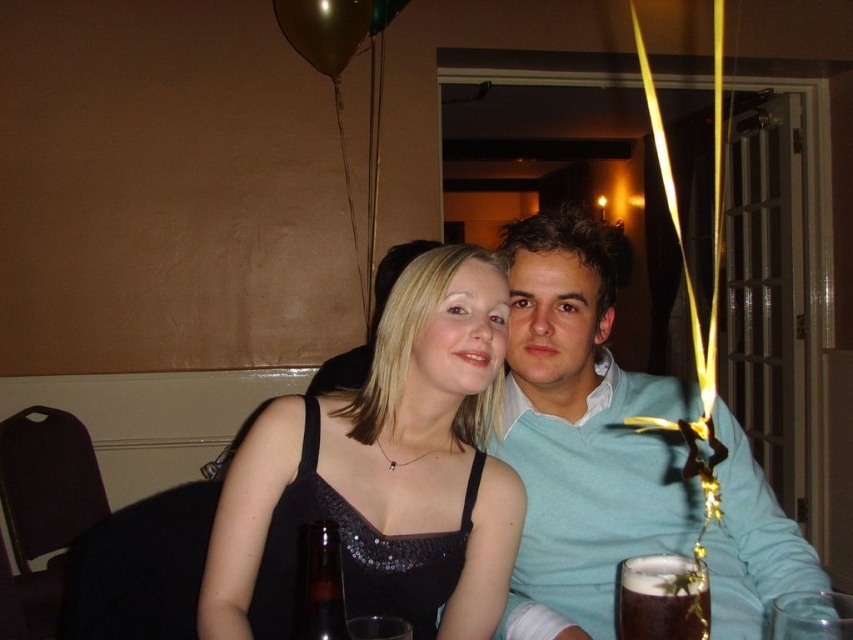
Between brown frothy beer at lower right and brown glass bottle at lower center, which one has less height?

brown frothy beer at lower right is shorter.

Who is taller, brown frothy beer at lower right or brown glass bottle at lower center?

Standing taller between the two is brown glass bottle at lower center.

Between point (660, 572) and point (312, 557), which one is positioned in front?

Point (312, 557) is in front.

At what (x,y) coordinates should I click in order to perform the action: click on brown frothy beer at lower right. Please return your answer as a coordinate pair (x, y). The width and height of the screenshot is (853, 640). Looking at the image, I should click on (662, 598).

This screenshot has width=853, height=640. What are the coordinates of `black satin dress at center` in the screenshot? It's located at (387, 467).

Is point (497, 492) farther from viewer compared to point (306, 547)?

Yes, point (497, 492) is farther from viewer.

Identify the location of black satin dress at center. This screenshot has height=640, width=853. (387, 467).

Is point (321, 29) behind point (318, 602)?

Yes, point (321, 29) is farther from viewer.

Does gold metallic balloon at upper center appear on the right side of brown glass bottle at lower center?

No, gold metallic balloon at upper center is not to the right of brown glass bottle at lower center.

Does point (283, 1) come closer to viewer compared to point (328, 563)?

That is False.

Where is `gold metallic balloon at upper center`? The width and height of the screenshot is (853, 640). gold metallic balloon at upper center is located at coordinates (323, 29).